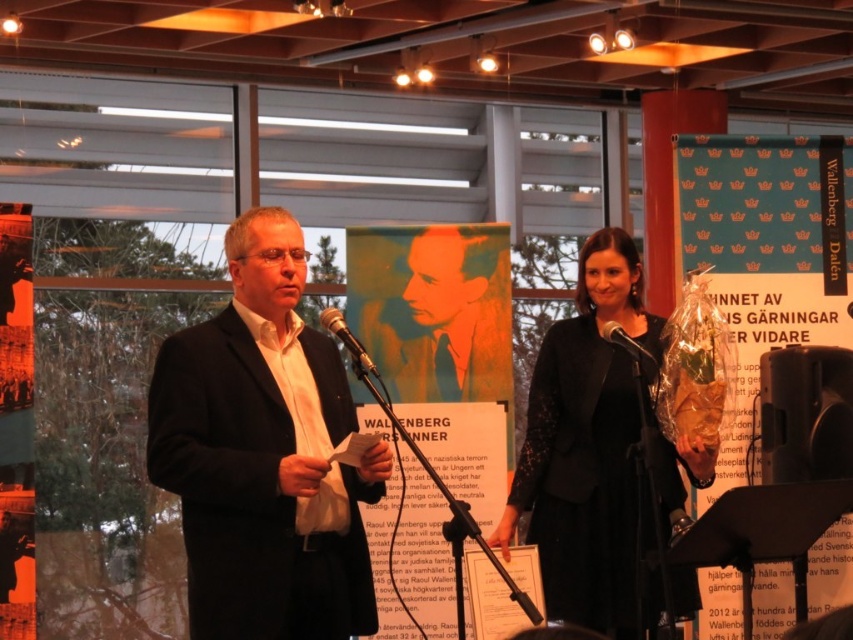
Looking at this image, you are attending the event and want to locate the matte black poster at upper center. Based on the coordinates provided in the Objects Description, where should you look relative to the two individuals at the podiums?

The matte black poster at upper center is located at coordinates point [16,424], which means it is positioned to the right and slightly above the two individuals at the podiums.

You are an event planner setting up for a presentation. You need to ensure that the matte black poster at upper center and the black matte microphone at center are visible to the audience. Considering their sizes, which object might require a more strategic placement to ensure visibility?

The matte black poster at upper center has a lesser width compared to the black matte microphone at center, so it might need to be placed in a more prominent position to ensure visibility.

You are an event organizer who needs to ensure all equipment is properly set up. You notice the matte black suit at center and the black plastic microphone at center. Which object is bigger in size?

The matte black suit at center is larger in size compared to the black plastic microphone at center.